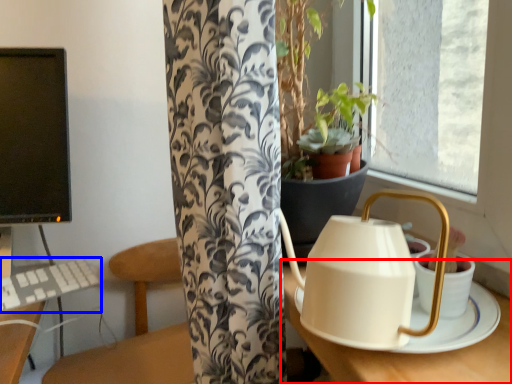
Question: Which object appears farthest to the camera in this image, round table (highlighted by a red box) or keyboard (highlighted by a blue box)?

Choices:
 (A) round table
 (B) keyboard

Answer: (B)